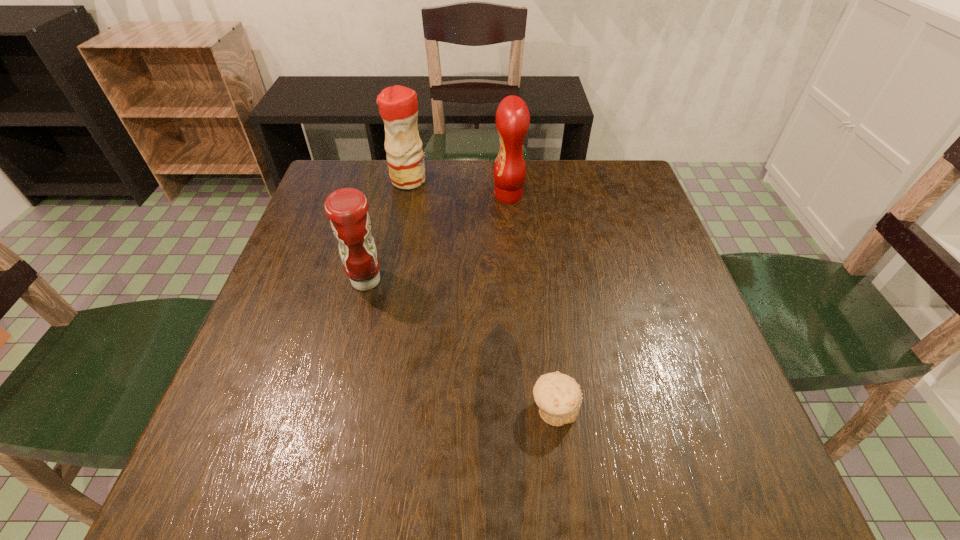
The width and height of the screenshot is (960, 540). I want to click on vacant area that lies between the rightmost condiment and the second nearest object, so click(438, 238).

The image size is (960, 540). In order to click on vacant area between the rightmost condiment and the muffin in this screenshot , I will do `click(532, 302)`.

Locate an element on the screen. The width and height of the screenshot is (960, 540). vacant space that is in between the rightmost condiment and the nearest object is located at coordinates (532, 302).

Find the location of a particular element. object that can be found as the second closest to the rightmost condiment is located at coordinates (347, 208).

The width and height of the screenshot is (960, 540). I want to click on object that is the second closest one to the shortest condiment, so click(x=512, y=116).

Find the location of a particular element. condiment identified as the closest to the third farthest object is located at coordinates (398, 106).

In order to click on condiment that can be found as the closest to the rightmost condiment in this screenshot , I will do `click(398, 106)`.

Find the location of a particular element. Image resolution: width=960 pixels, height=540 pixels. free location that satisfies the following two spatial constraints: 1. on the label side of the rightmost condiment; 2. on the left side of the muffin is located at coordinates (525, 409).

Find the location of `free location that satisfies the following two spatial constraints: 1. on the front side of the nearest condiment; 2. on the left side of the muffin`. free location that satisfies the following two spatial constraints: 1. on the front side of the nearest condiment; 2. on the left side of the muffin is located at coordinates (334, 409).